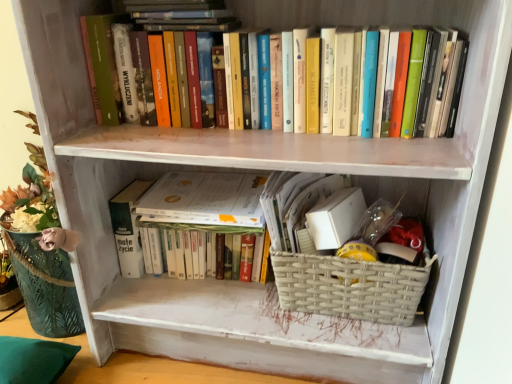
What are the coordinates of `vacant area on top of white paper at center (from a real-world perspective)` in the screenshot? It's located at (211, 191).